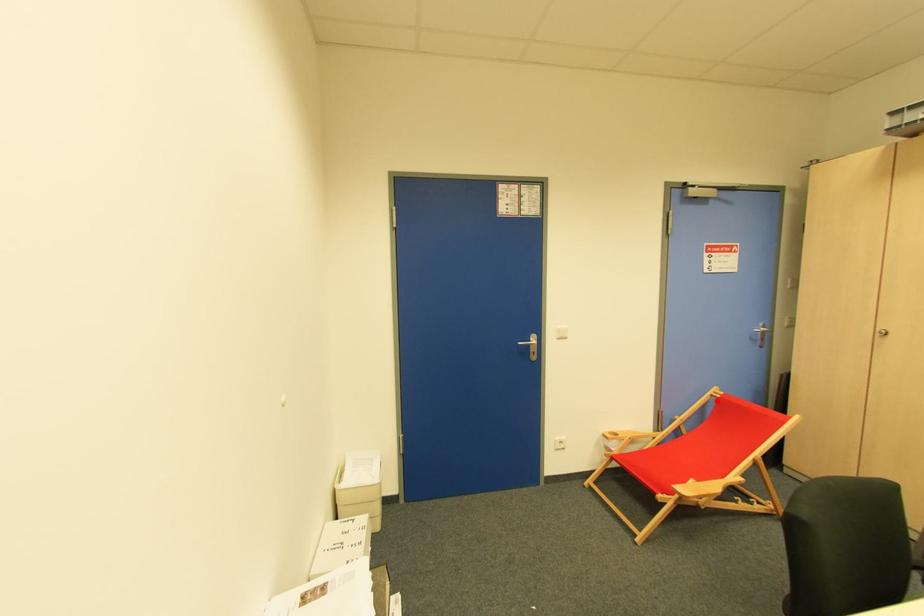
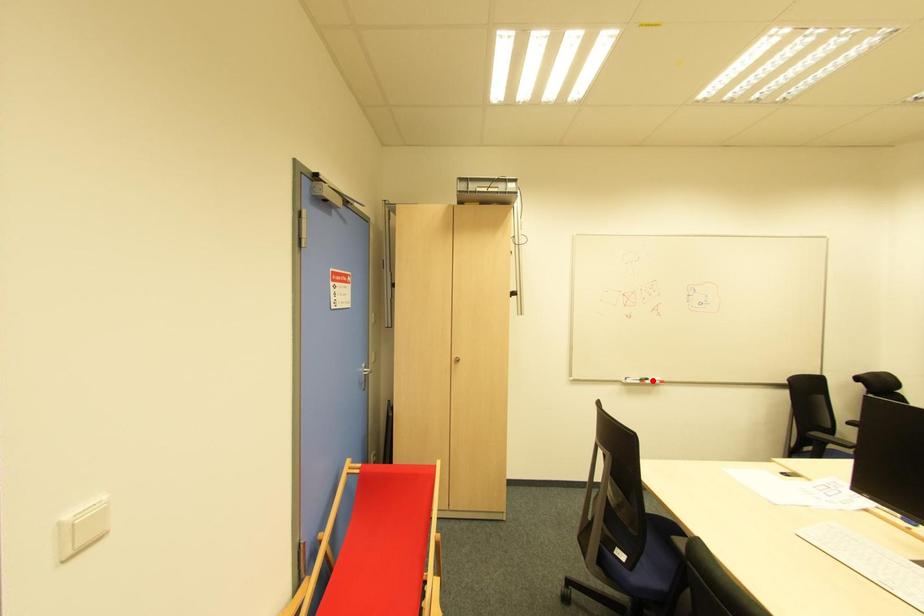
I am providing you with two images of the same scene from different viewpoints. A red point is marked on the first image and another point is marked on the second image. Is the red point in image1 aligned with the point shown in image2?

No